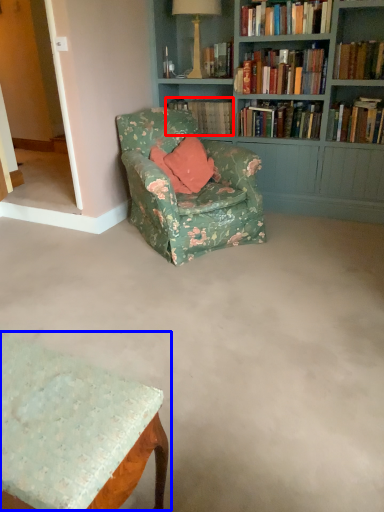
Question: Which point is further to the camera, book (highlighted by a red box) or table (highlighted by a blue box)?

Choices:
 (A) book
 (B) table

Answer: (A)